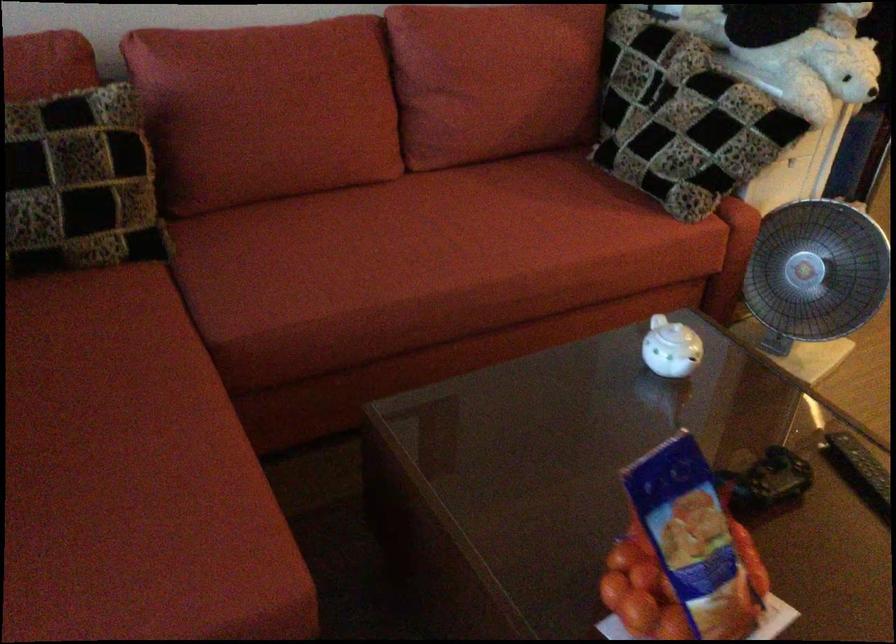
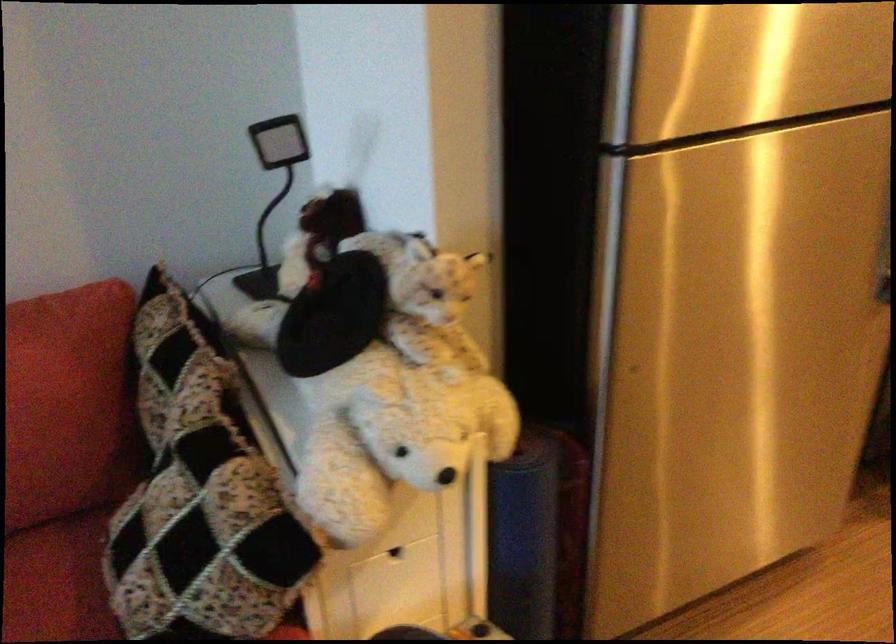
In a continuous first-person perspective shot, in which direction is the camera moving?

The cameraman walked toward right, forward.